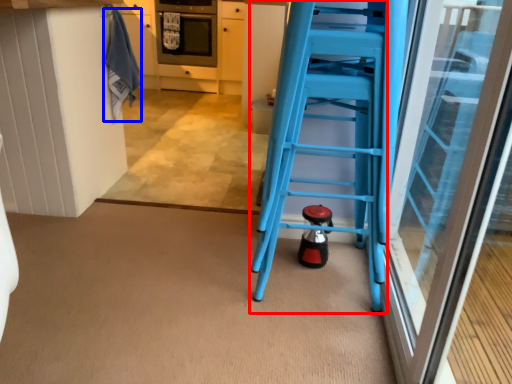
Question: Which of the following is the closest to the observer, ladder (highlighted by a red box) or laundry (highlighted by a blue box)?

Choices:
 (A) ladder
 (B) laundry

Answer: (A)